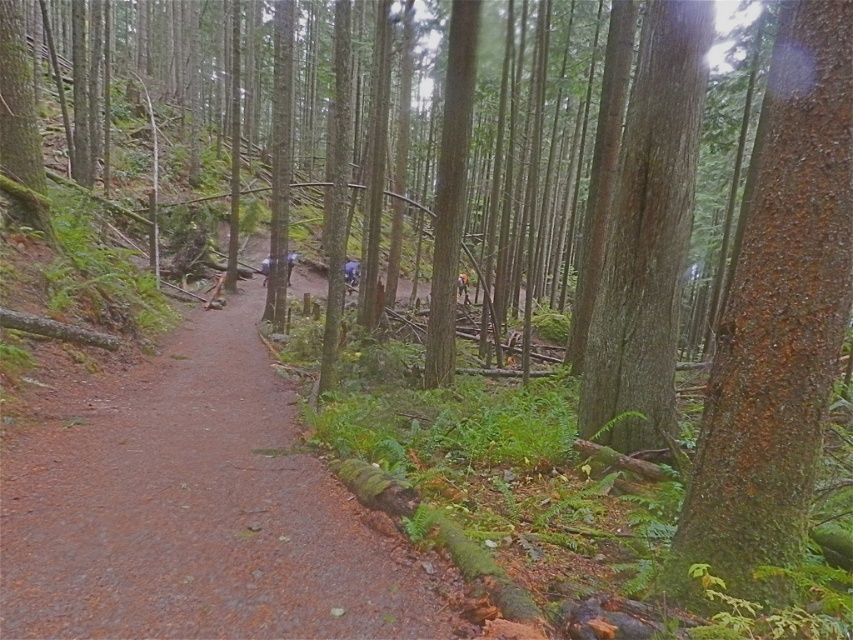
You are standing at the edge of the forest and want to find the brown dirt path at center. According to the coordinates provided, where should you look to locate it?

The brown dirt path at center is located at point [195,509].

You are a hiker who wants to walk along the brown dirt path at center. However, you notice the green rough bark tree at right. Is there enough space for you to walk under the tree without hitting your head?

The brown dirt path at center is positioned under green rough bark tree at right, so the tree overhangs the path. Since the path is under the tree, you should be able to walk under it without hitting your head as long as you stay on the path.